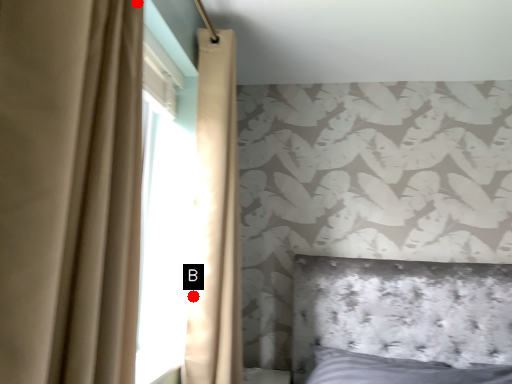
Question: Two points are circled on the image, labeled by A and B beside each circle. Which point appears closest to the camera in this image?

Choices:
 (A) A is closer
 (B) B is closer

Answer: (A)